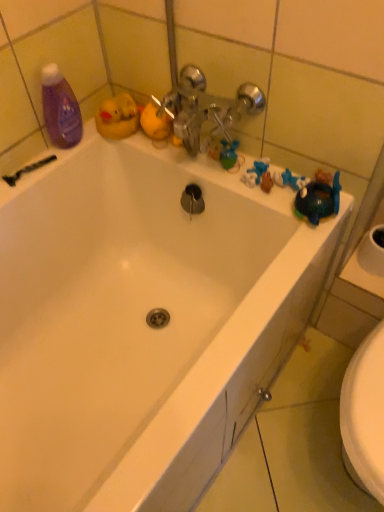
Question: From the image's perspective, relative to black plastic razor at upper left, is purple glossy bottle at upper left above or below?

Choices:
 (A) below
 (B) above

Answer: (B)

Question: Based on their sizes in the image, would you say purple glossy bottle at upper left is bigger or smaller than black plastic razor at upper left?

Choices:
 (A) small
 (B) big

Answer: (B)

Question: In the image, is purple glossy bottle at upper left positioned in front of or behind black plastic razor at upper left?

Choices:
 (A) behind
 (B) front

Answer: (B)

Question: Is black plastic razor at upper left wider or thinner than purple glossy bottle at upper left?

Choices:
 (A) wide
 (B) thin

Answer: (B)

Question: From a real-world perspective, is black plastic razor at upper left positioned above or below purple glossy bottle at upper left?

Choices:
 (A) above
 (B) below

Answer: (B)

Question: In terms of height, does black plastic razor at upper left look taller or shorter compared to purple glossy bottle at upper left?

Choices:
 (A) short
 (B) tall

Answer: (A)

Question: Relative to purple glossy bottle at upper left, is black plastic razor at upper left in front or behind?

Choices:
 (A) front
 (B) behind

Answer: (B)